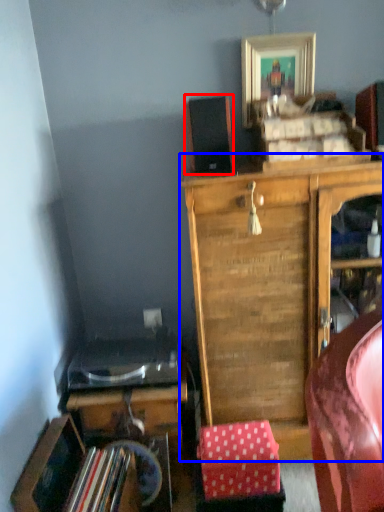
Question: Which object appears farthest to the camera in this image, speaker (highlighted by a red box) or cabinetry (highlighted by a blue box)?

Choices:
 (A) speaker
 (B) cabinetry

Answer: (A)